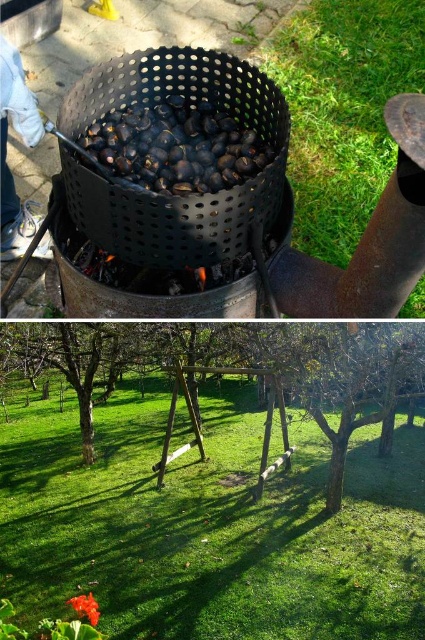
You are a chef preparing a dish that requires placing the black matte chestnuts at center and the smooth glossy flower at lower left on a plate. Based on their positions in the image, where should you place the flower relative to the chestnuts?

The black matte chestnuts at center is located above the smooth glossy flower at lower left, so you should place the flower below the chestnuts on the plate.

You are a chef preparing roasted chestnuts and see the black matte chestnuts at center and the smooth glossy flower at lower left in the basket. Which item is positioned more to the left side?

The smooth glossy flower at lower left is positioned more to the left side than the black matte chestnuts at center.

You are a gardener who wants to place a new flower pot between the black matte chestnuts at center and the smooth glossy flower at lower left. What is the minimum distance you need to cover to place the pot exactly halfway between them?

The black matte chestnuts at center and the smooth glossy flower at lower left are 2.81 meters apart. To place the pot exactly halfway, you need to cover a minimum distance of 1.405 meters from either object.